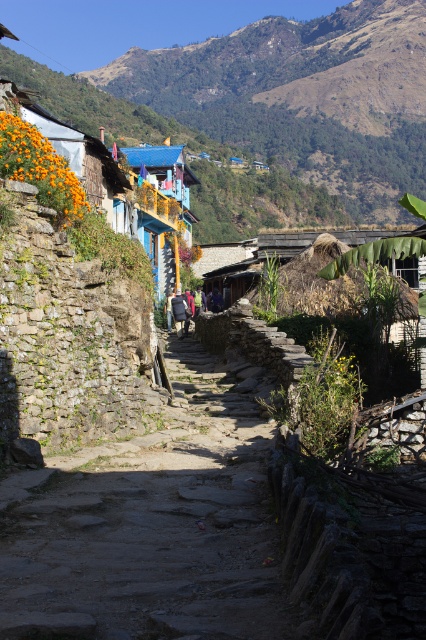
You are standing at the entrance of the village and want to reach the village square located at the center. According to the image, which direction should you walk along the natural stone path at center to reach the square?

Since the natural stone path at center is positioned at coordinates point (152,525), you should walk along the natural stone path at center towards the center of the village to reach the square.